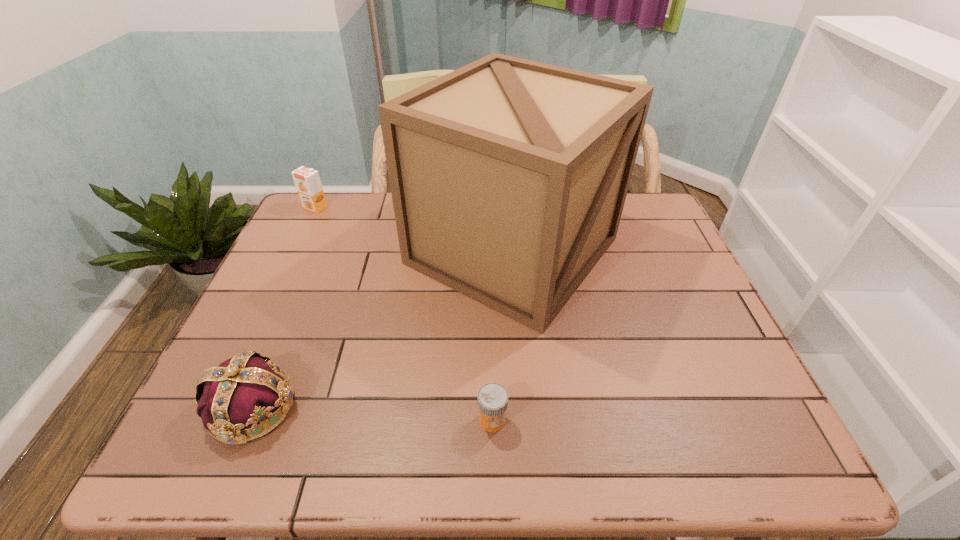
Find the location of a particular element. Image resolution: width=960 pixels, height=540 pixels. free space in the image that satisfies the following two spatial constraints: 1. on the back side of the tallest object; 2. on the left side of the crown is located at coordinates (319, 251).